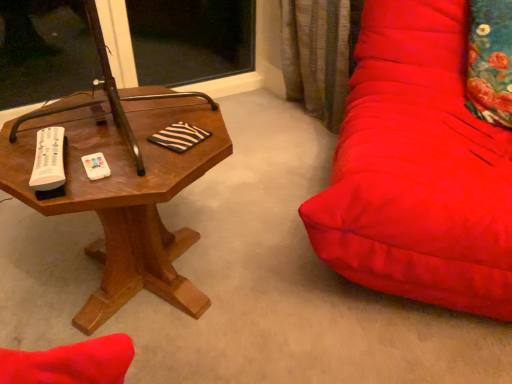
This screenshot has width=512, height=384. I want to click on free point behind woodenobject at left, so (x=231, y=187).